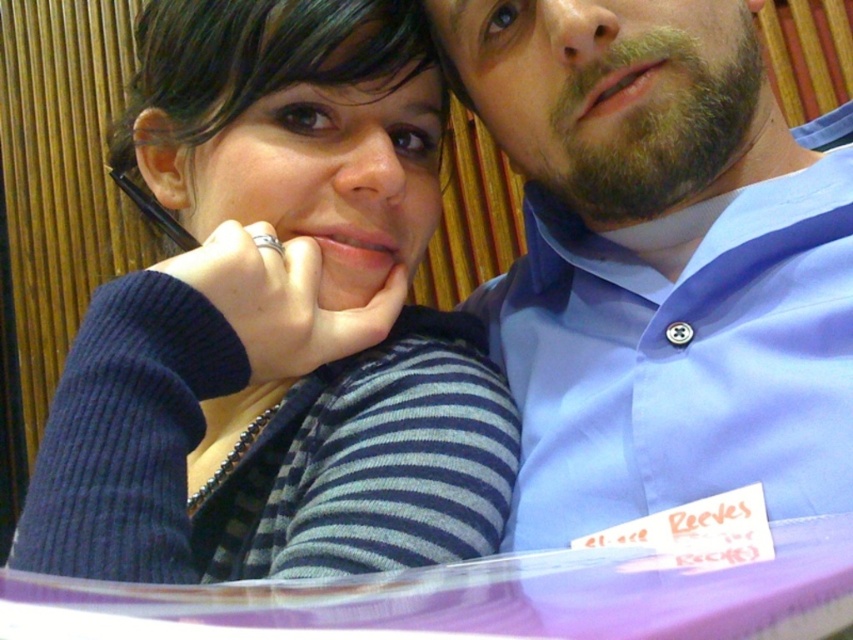
You are standing at the point marked as point (222, 64) in the image. You want to reach the door located behind the man in the light blue collared shirt. The shortest path to the door requires moving in a straight line from your current position. However, there is a 24.83 inch wide obstacle directly in your path. Can you navigate around it without moving more than 12 inches sideways?

The point marked as point (222, 64) and the viewer are 24.83 inches apart. Since the obstacle is 24.83 inches wide and you can only move 12 inches sideways, you cannot navigate around it without moving more than the allowed distance. You need to find an alternative path.